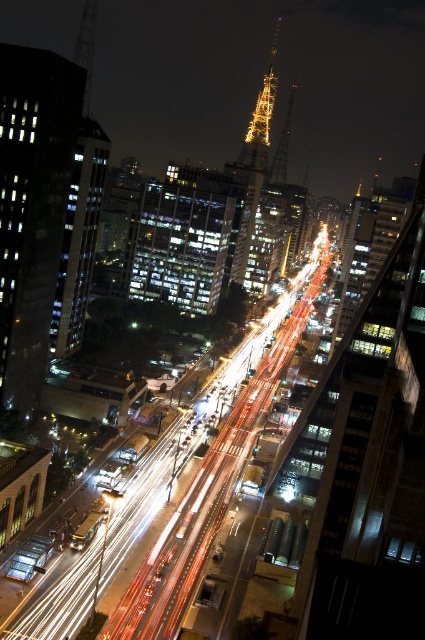
You are standing on a rooftop and want to locate the glassy reflective building at center. According to the coordinates provided, where exactly is it positioned?

The glassy reflective building at center is located at point coordinates of 0.373 on the x axis and 0.433 on the y axis.

In the scene shown: You are a city planner analyzing this nighttime cityscape. You need to determine which of the two structures, the glassy reflective building at center or the shiny metallic tower at center, would be more suitable for installing a new public art installation that requires a large surface area. Based on their sizes, which structure would you recommend?

The shiny metallic tower at center has a larger size compared to the glassy reflective building at center, making it more suitable for installing a new public art installation that requires a large surface area.